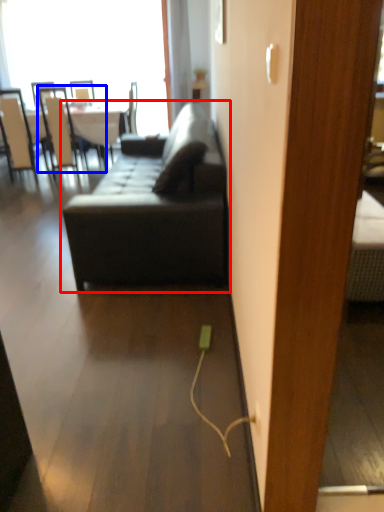
Question: Which object is closer to the camera taking this photo, studio couch (highlighted by a red box) or chair (highlighted by a blue box)?

Choices:
 (A) studio couch
 (B) chair

Answer: (A)